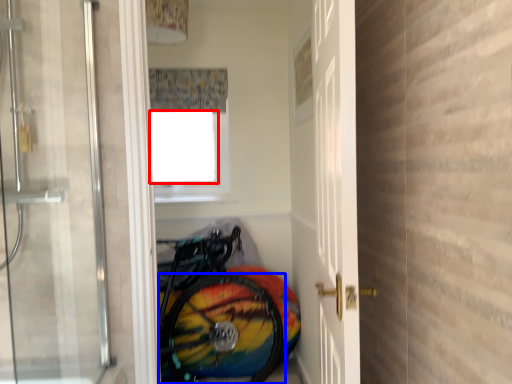
Question: Which point is closer to the camera, window screen (highlighted by a red box) or bicycle wheel (highlighted by a blue box)?

Choices:
 (A) window screen
 (B) bicycle wheel

Answer: (B)